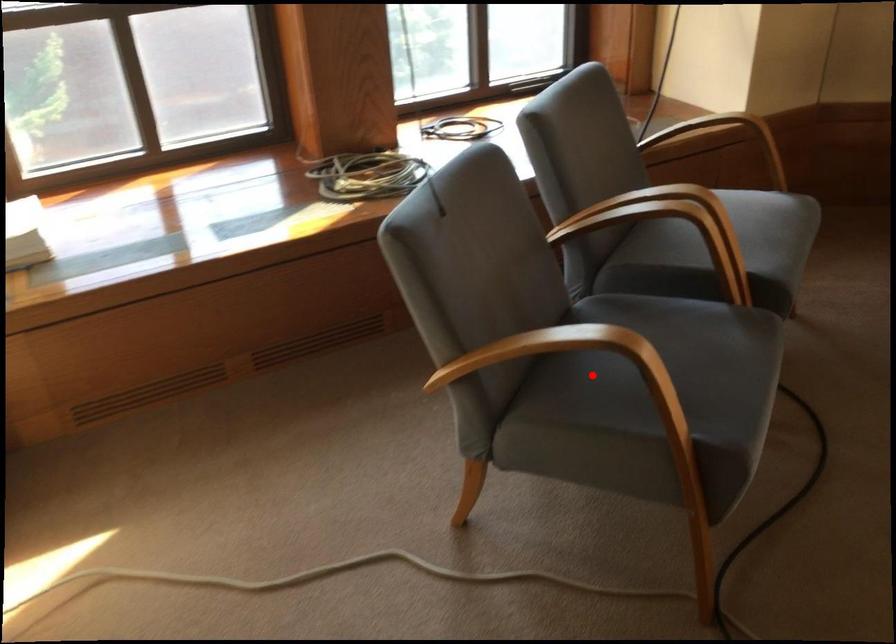
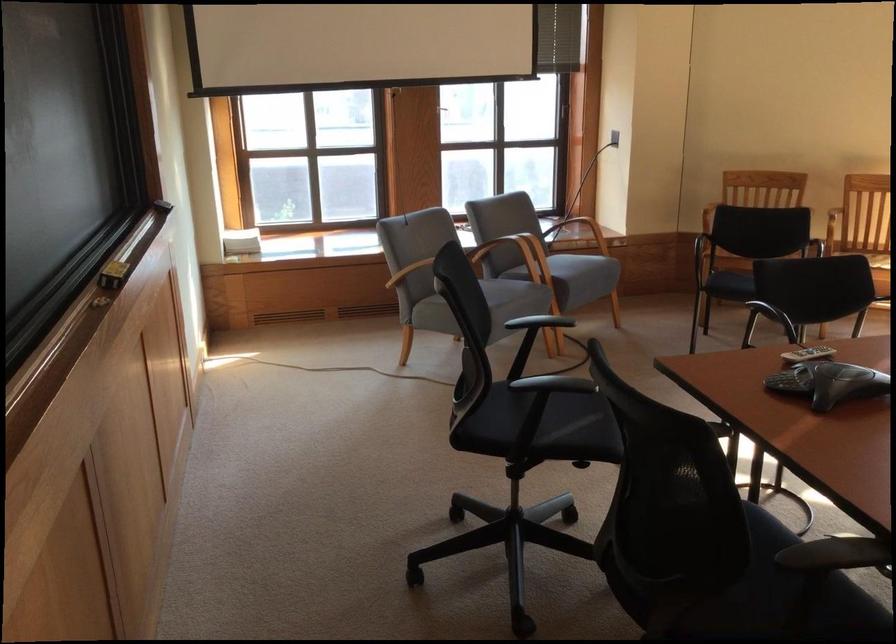
Question: I am providing you with two images of the same scene from different viewpoints. A red point is marked on the first image. Can you still see the location of the red point in image 2?

Choices:
 (A) Yes
 (B) No

Answer: (B)